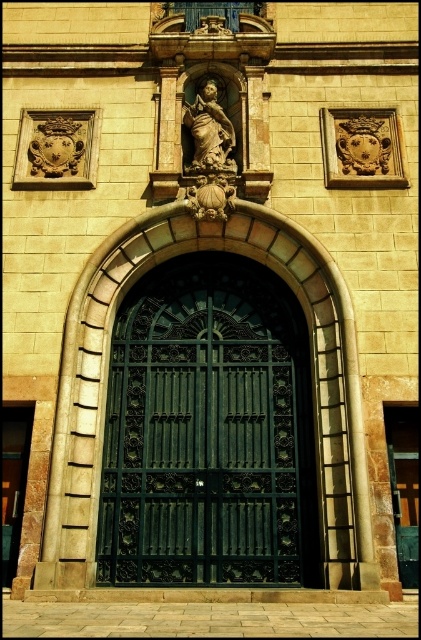
Question: In this image, where is dark green metal gate at center located relative to matte stone statue at center?

Choices:
 (A) below
 (B) above

Answer: (A)

Question: Which object appears closest to the camera in this image?

Choices:
 (A) dark green wrought iron gate at center
 (B) matte stone statue at center

Answer: (A)

Question: Which object is positioned farthest from the dark green metal gate at center?

Choices:
 (A) dark green wrought iron gate at center
 (B) matte stone statue at center

Answer: (B)

Question: Does dark green wrought iron gate at center have a greater width compared to matte stone statue at center?

Choices:
 (A) no
 (B) yes

Answer: (B)

Question: Considering the relative positions of dark green metal gate at center and matte stone statue at center in the image provided, where is dark green metal gate at center located with respect to matte stone statue at center?

Choices:
 (A) right
 (B) left

Answer: (A)

Question: Among these objects, which one is nearest to the camera?

Choices:
 (A) matte stone statue at center
 (B) dark green wrought iron gate at center
 (C) dark green metal gate at center

Answer: (C)